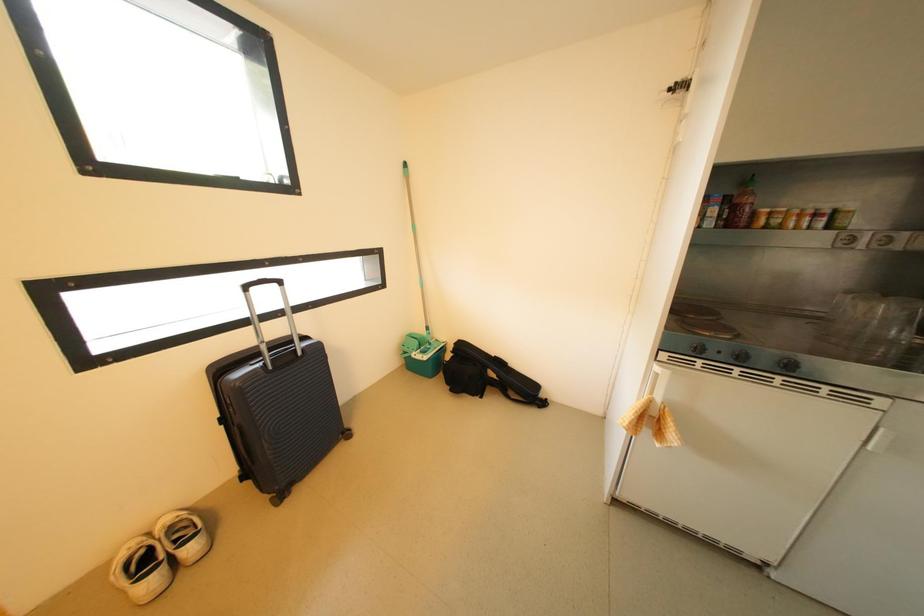
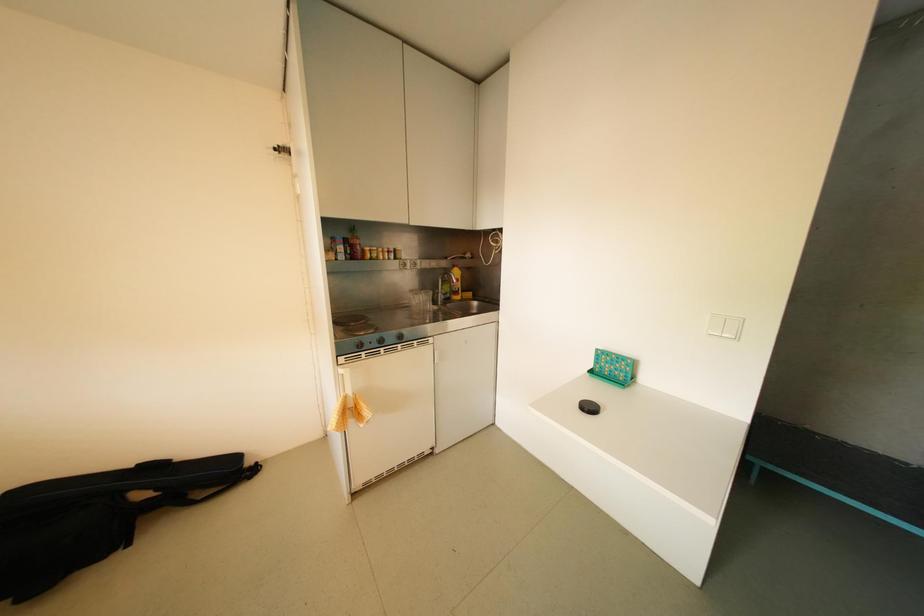
Question: The camera is either moving clockwise (left) or counter-clockwise (right) around the object. The first image is from the beginning of the video and the second image is from the end. Is the camera moving left or right when shooting the video?

Choices:
 (A) Left
 (B) Right

Answer: (A)